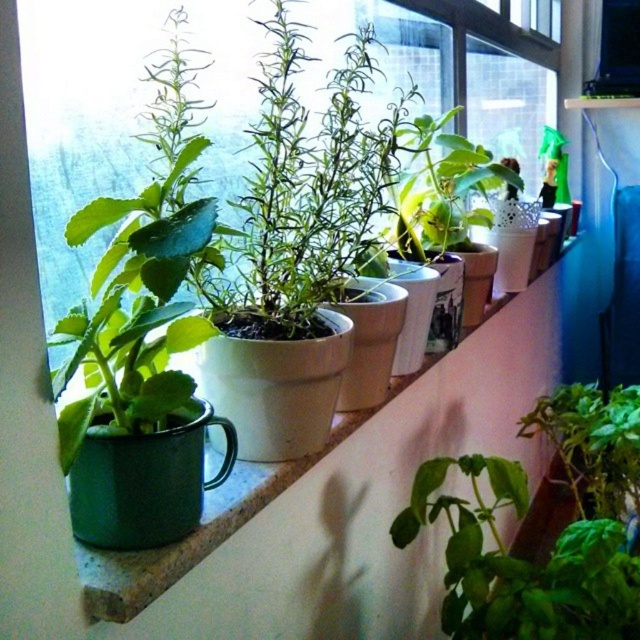
You are a gardener who wants to water the plants. You have a watering can that needs to be placed exactly between the green ceramic mug at left and the green matte plant at center. How far apart should you place the watering can from each object?

The green ceramic mug at left and green matte plant at center are 8.21 inches apart. To place the watering can exactly between them, it should be 4.105 inches away from each object.

You are a plant enthusiast who wants to place a new plant pot on the windowsill. The windowsill is 1 meter long. The green ceramic mug at left is already placed at position 0.823 meters from the left end. Can you place another pot at position 0.319 meters from the left end without overlapping with the existing mug?

The green ceramic mug at left is at position 0.823 meters from the left end. The new pot would be placed at 0.319 meters from the left end. Since 0.319 meters is less than 0.823 meters, there is enough space between them, so yes, you can place the new pot at 0.319 meters without overlapping.

You are arranging plants on a windowsill and see the green ceramic mug at left and the green matte leafy plant at center. Which object is positioned more to the left?

The green ceramic mug at left is positioned more to the left than the green matte leafy plant at center.